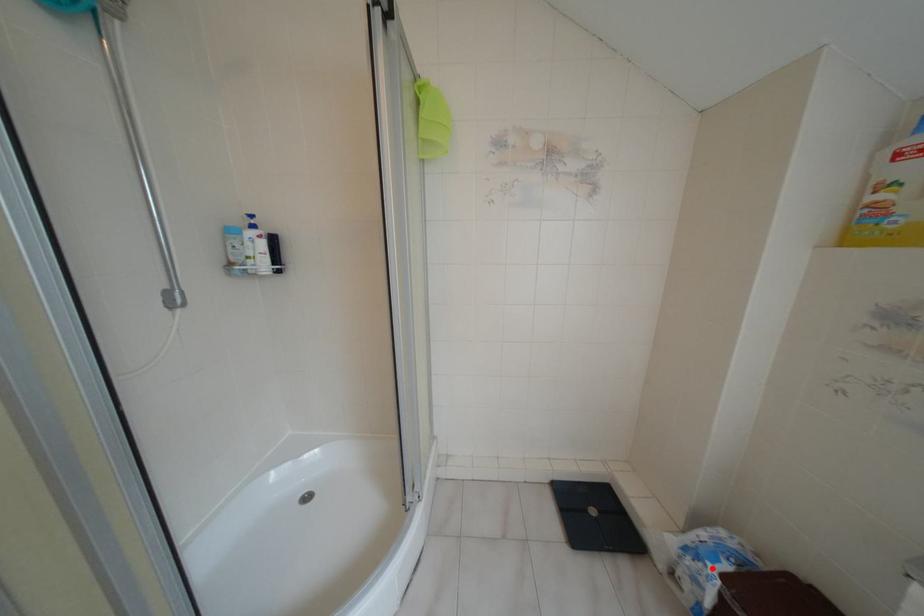
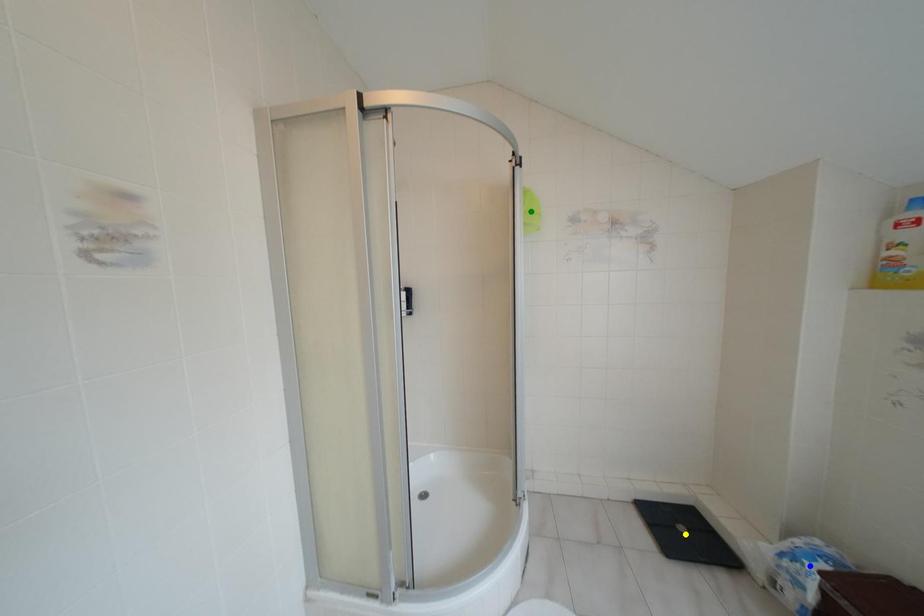
Question: I am providing you with two images of the same scene from different viewpoints. A red point is marked on the first image. You are given multiple points on the second image. Which point in image 2 represents the same 3d spot as the red point in image 1?

Choices:
 (A) green point
 (B) blue point
 (C) yellow point

Answer: (B)